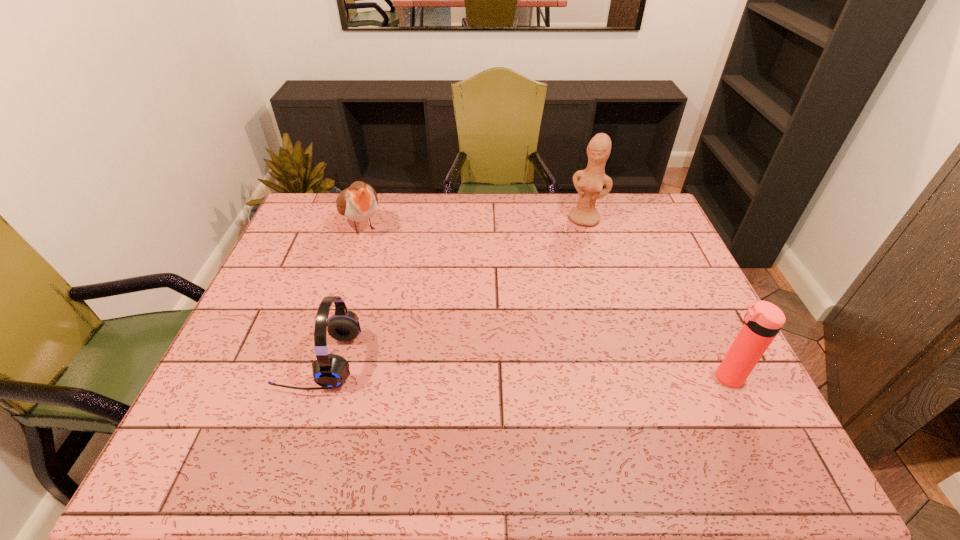
You are a GUI agent. You are given a task and a screenshot of the screen. Output one action in this format:
    pyautogui.click(x=<x>, y=<y>)
    Task: Click on the headset
    This screenshot has height=540, width=960.
    Given the screenshot: What is the action you would take?
    pyautogui.click(x=330, y=371)

Where is `thermos bottle`? The height and width of the screenshot is (540, 960). thermos bottle is located at coordinates (763, 320).

The width and height of the screenshot is (960, 540). Find the location of `the rightmost object`. the rightmost object is located at coordinates (763, 320).

Find the location of a particular element. This screenshot has width=960, height=540. figurine is located at coordinates (589, 183).

The image size is (960, 540). Identify the location of the third object from left to right. (589, 183).

Find the location of a particular element. The image size is (960, 540). bird is located at coordinates (358, 203).

Find the location of a particular element. This screenshot has width=960, height=540. blank area located 0.060m on the ear cushions of the headset is located at coordinates (258, 360).

This screenshot has width=960, height=540. Find the location of `free space located on the ear cushions of the headset`. free space located on the ear cushions of the headset is located at coordinates (229, 360).

Identify the location of vacant space situated on the ear cushions of the headset. Image resolution: width=960 pixels, height=540 pixels. (229, 360).

Where is `vacant space located 0.260m on the left of the thermos bottle`? vacant space located 0.260m on the left of the thermos bottle is located at coordinates (605, 377).